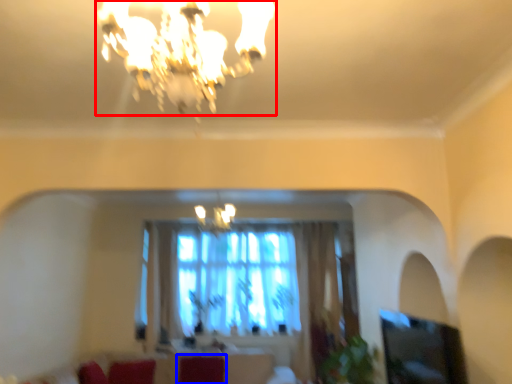
Question: Among these objects, which one is farthest to the camera, lamp (highlighted by a red box) or swivel chair (highlighted by a blue box)?

Choices:
 (A) lamp
 (B) swivel chair

Answer: (B)